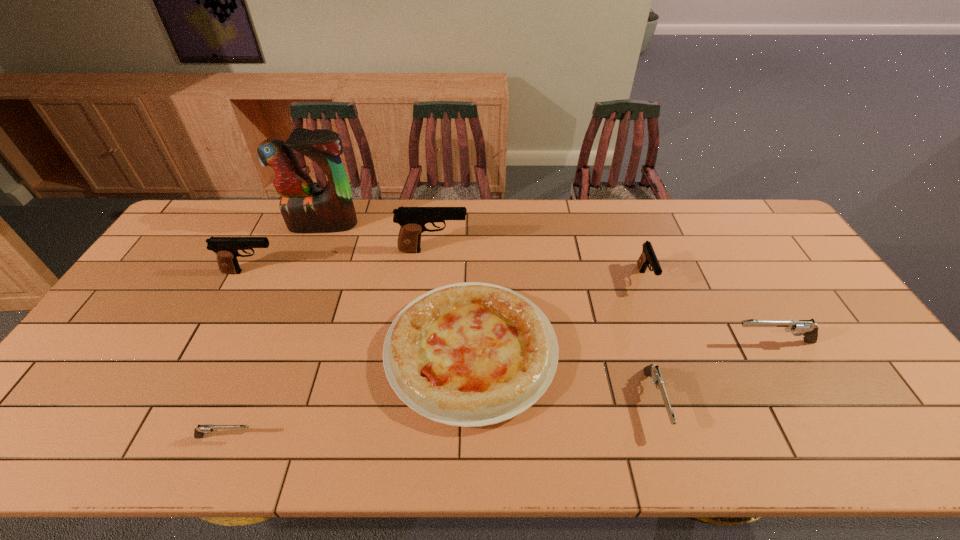
This screenshot has width=960, height=540. Identify the location of free space located on the front-facing side of the fourth farthest pistol. (592, 342).

This screenshot has width=960, height=540. In order to click on blank space located 0.170m on the front-facing side of the fourth farthest pistol in this screenshot , I will do `click(667, 342)`.

This screenshot has height=540, width=960. Find the location of `vacant position located on the left of the pizza`. vacant position located on the left of the pizza is located at coordinates (313, 352).

This screenshot has height=540, width=960. Identify the location of free location located on the front-facing side of the leftmost silver pistol. (335, 437).

Find the location of a particular element. object situated at the far edge is located at coordinates (304, 209).

You are a GUI agent. You are given a task and a screenshot of the screen. Output one action in this format:
    pyautogui.click(x=<x>, y=<y>)
    Task: Click on the pizza located at the near edge
    This screenshot has height=540, width=960.
    Given the screenshot: What is the action you would take?
    pyautogui.click(x=470, y=354)

Identify the location of object present at the right edge. Image resolution: width=960 pixels, height=540 pixels. (809, 330).

This screenshot has height=540, width=960. In the image, there is a desktop. Identify the location of vacant space at the far edge. (359, 242).

Locate an element on the screen. Image resolution: width=960 pixels, height=540 pixels. vacant space at the near edge of the desktop is located at coordinates (415, 457).

Find the location of a particular element. Image resolution: width=960 pixels, height=540 pixels. free spot at the left edge of the desktop is located at coordinates (125, 309).